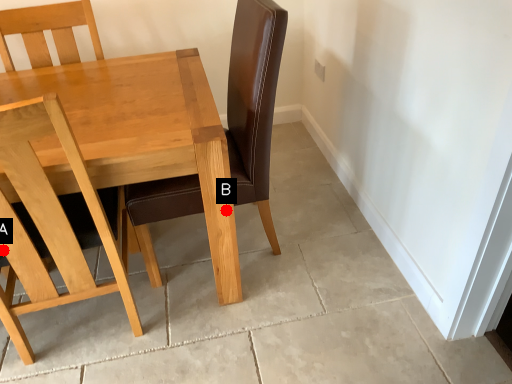
Question: Two points are circled on the image, labeled by A and B beside each circle. Which point is closer to the camera?

Choices:
 (A) A is closer
 (B) B is closer

Answer: (A)